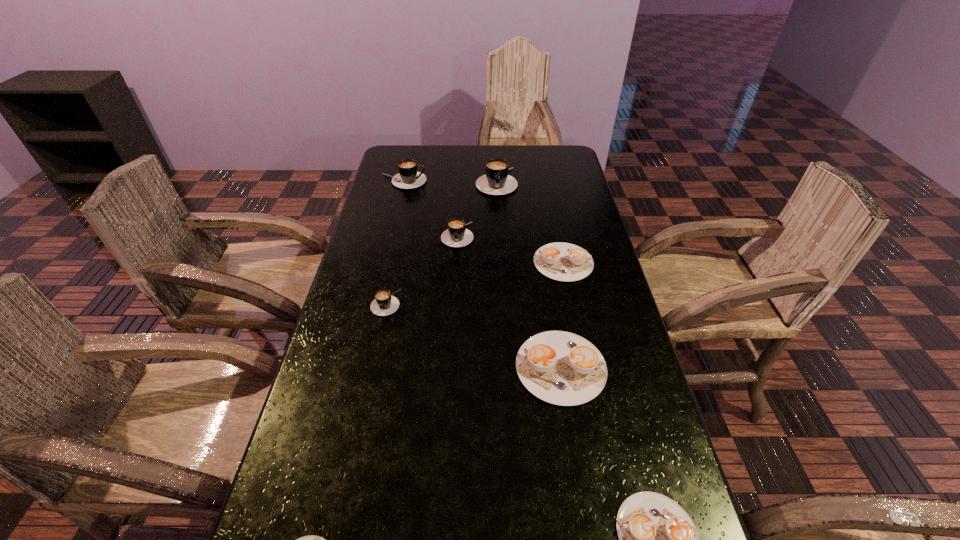
This screenshot has width=960, height=540. I want to click on the fifth closest object relative to the leftmost white cappuccino, so click(x=456, y=235).

Select which cappuccino is the third closest to the tallest object. Please provide its 2D coordinates. Your answer should be formatted as a tuple, i.e. [(x, y)], where the tuple contains the x and y coordinates of a point satisfying the conditions above.

[(560, 261)]

The height and width of the screenshot is (540, 960). What are the coordinates of `cappuccino that stands as the sixth closest to the second nearest black cappuccino` in the screenshot? It's located at (657, 539).

Choose which black cappuccino is the second nearest neighbor to the seventh tallest cappuccino. Please provide its 2D coordinates. Your answer should be formatted as a tuple, i.e. [(x, y)], where the tuple contains the x and y coordinates of a point satisfying the conditions above.

[(456, 235)]

Locate an element on the screen. black cappuccino that is the third closest to the third smallest black cappuccino is located at coordinates (384, 304).

The height and width of the screenshot is (540, 960). I want to click on white cappuccino that is the second nearest to the shortest object, so click(657, 539).

Find the location of a particular element. This screenshot has width=960, height=540. the third closest white cappuccino relative to the nearest black cappuccino is located at coordinates (311, 539).

Image resolution: width=960 pixels, height=540 pixels. Find the location of `free space that satisfies the following two spatial constraints: 1. with the handle on the side of the tallest cappuccino; 2. on the right side of the sixth tallest cappuccino`. free space that satisfies the following two spatial constraints: 1. with the handle on the side of the tallest cappuccino; 2. on the right side of the sixth tallest cappuccino is located at coordinates (500, 262).

Where is `vacant space that satisfies the following two spatial constraints: 1. with the handle on the side of the third black cappuccino from left to right; 2. on the right side of the sixth tallest object`? The image size is (960, 540). vacant space that satisfies the following two spatial constraints: 1. with the handle on the side of the third black cappuccino from left to right; 2. on the right side of the sixth tallest object is located at coordinates (456, 262).

Where is `vacant point that satisfies the following two spatial constraints: 1. with the handle on the side of the second farthest white cappuccino; 2. on the left side of the rightmost black cappuccino`? The width and height of the screenshot is (960, 540). vacant point that satisfies the following two spatial constraints: 1. with the handle on the side of the second farthest white cappuccino; 2. on the left side of the rightmost black cappuccino is located at coordinates (506, 367).